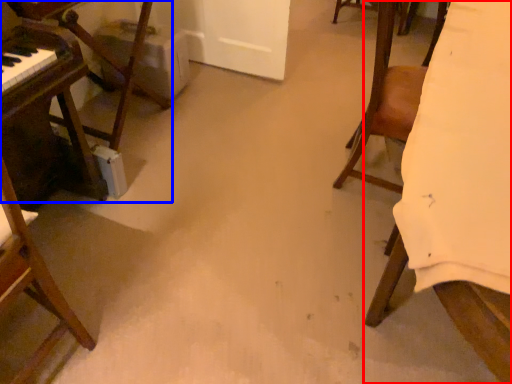
Question: Which of the following is the farthest to the observer, furniture (highlighted by a red box) or furniture (highlighted by a blue box)?

Choices:
 (A) furniture
 (B) furniture

Answer: (B)